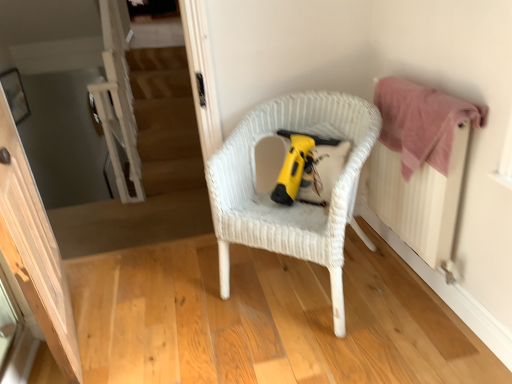
Identify the location of free point in front of white wicker chair at center. This screenshot has width=512, height=384. pyautogui.click(x=312, y=356).